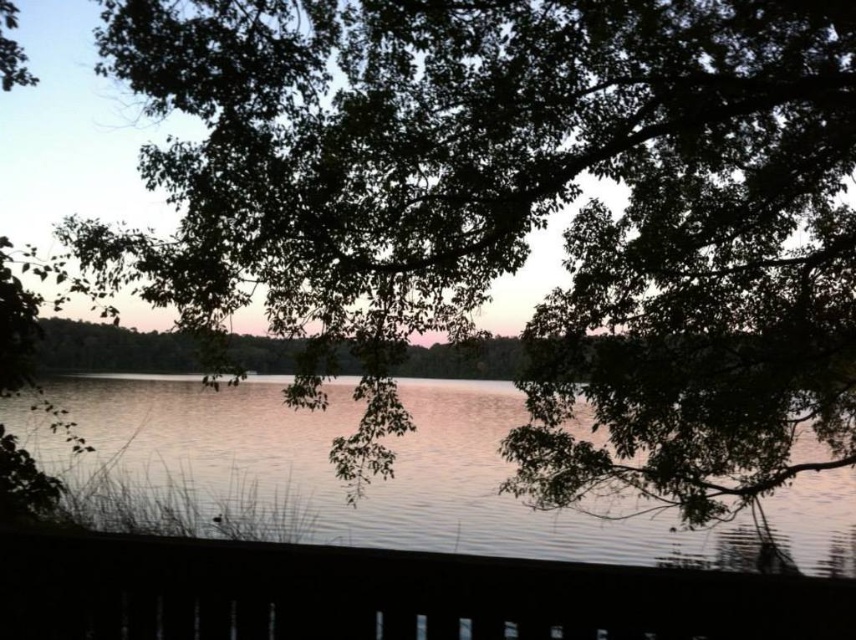
Is smooth wooden deck at lower center shorter than silvery reflective water at center?

Correct, smooth wooden deck at lower center is not as tall as silvery reflective water at center.

At what (x,y) coordinates should I click in order to perform the action: click on smooth wooden deck at lower center. Please return your answer as a coordinate pair (x, y). Looking at the image, I should click on (383, 595).

Image resolution: width=856 pixels, height=640 pixels. In order to click on smooth wooden deck at lower center in this screenshot , I will do `click(383, 595)`.

Image resolution: width=856 pixels, height=640 pixels. Find the location of `smooth wooden deck at lower center`. smooth wooden deck at lower center is located at coordinates (383, 595).